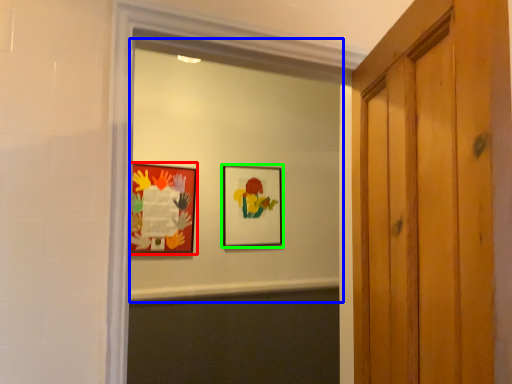
Question: Which object is the farthest from picture frame (highlighted by a red box)? Choose among these: mirror (highlighted by a blue box) or picture frame (highlighted by a green box).

Choices:
 (A) mirror
 (B) picture frame

Answer: (B)